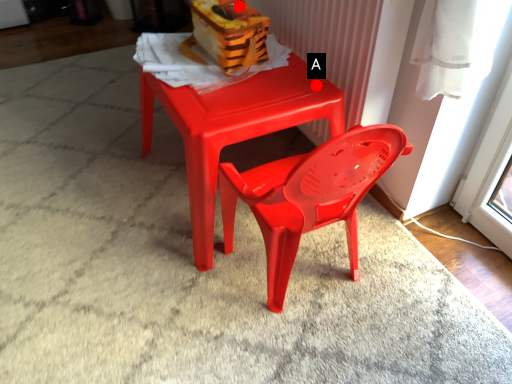
Question: Two points are circled on the image, labeled by A and B beside each circle. Which point is closer to the camera?

Choices:
 (A) A is closer
 (B) B is closer

Answer: (A)